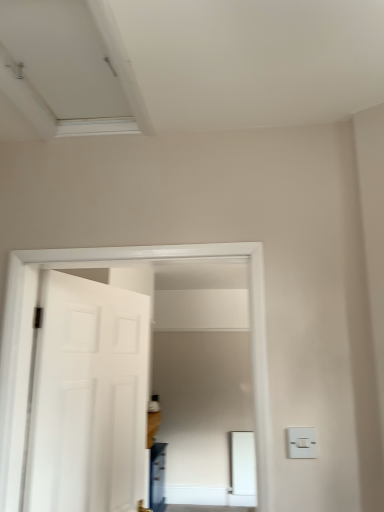
Question: Is white matte door at left taller or shorter than white matte exhaust hood at upper left?

Choices:
 (A) tall
 (B) short

Answer: (A)

Question: Is point (72, 472) positioned closer to the camera than point (52, 135)?

Choices:
 (A) farther
 (B) closer

Answer: (A)

Question: Which is nearer to the white plastic light switch at lower right?

Choices:
 (A) white matte door at left
 (B) white matte exhaust hood at upper left

Answer: (A)

Question: Which of these objects is positioned farthest from the white matte door at left?

Choices:
 (A) white matte exhaust hood at upper left
 (B) white plastic light switch at lower right

Answer: (B)